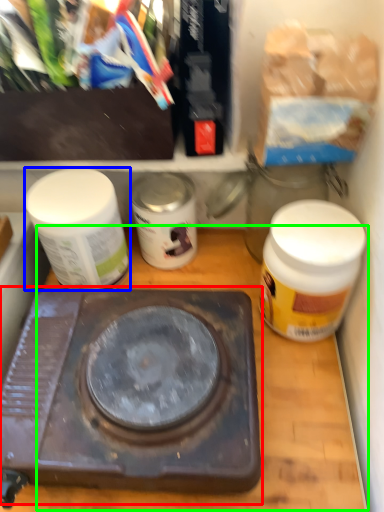
Question: Which object is positioned closest to stove (highlighted by a red box)? Select from bottle (highlighted by a blue box) and counter top (highlighted by a green box).

Choices:
 (A) bottle
 (B) counter top

Answer: (B)